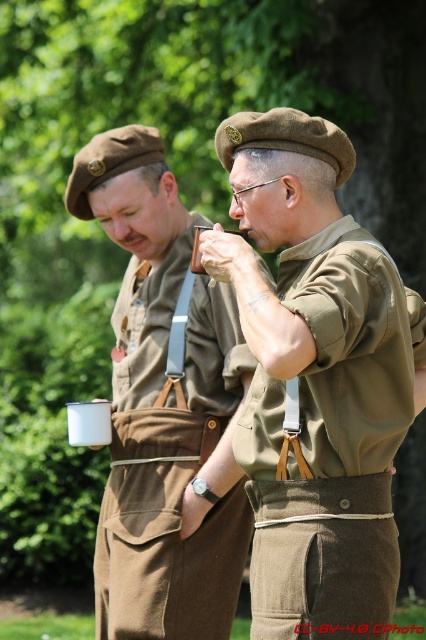
You are a photographer setting up a shot of the two individuals in the scene. You need to frame both the matte khaki shirt at center and the matte brown uniform at center in your shot. Based on their positions, which one should you adjust your camera angle to focus on first to ensure both fit in the frame?

The matte khaki shirt at center might be wider than the matte brown uniform at center, so you should focus on the matte khaki shirt at center first to ensure both fit in the frame.

Based on the scene description, which object is smaller in size between the matte khaki shirt at center and the matte brown uniform at center?

The matte khaki shirt at center is smaller than the matte brown uniform at center according to the description.